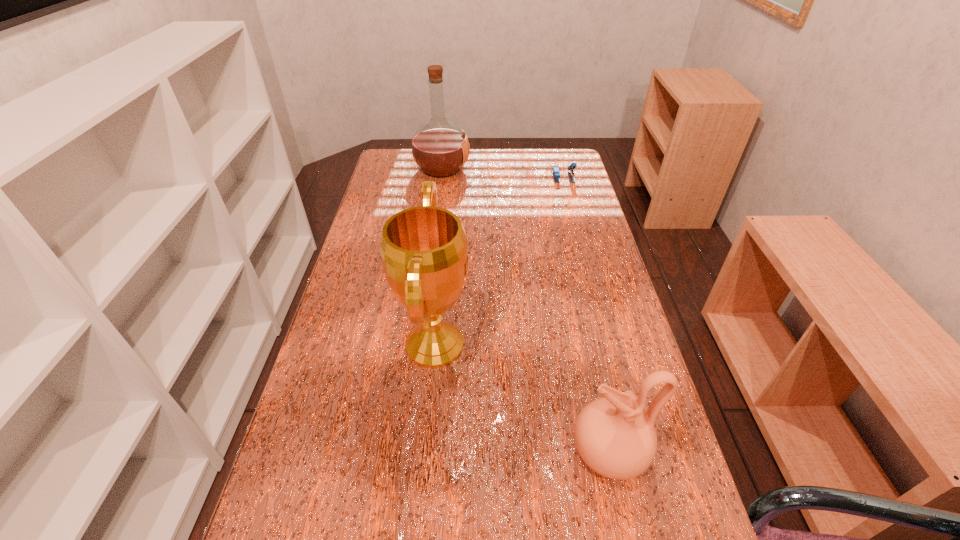
Image resolution: width=960 pixels, height=540 pixels. What are the coordinates of `free point that satisfies the following two spatial constraints: 1. on the front label of the stapler; 2. on the left side of the liquor` in the screenshot? It's located at 441,177.

Locate an element on the screen. The height and width of the screenshot is (540, 960). free space that satisfies the following two spatial constraints: 1. on the front label of the liquor; 2. on the back side of the stapler is located at coordinates (441, 177).